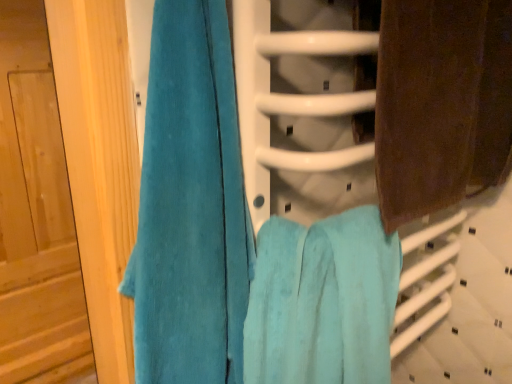
Question: Is teal plush towel at left, which is the third towel in right-to-left order, at the back of turquoise soft towel at center, the 2th towel when ordered from left to right?

Choices:
 (A) yes
 (B) no

Answer: (B)

Question: Is turquoise soft towel at center, the 2th towel when ordered from left to right, at the right side of teal plush towel at left, which is the third towel in right-to-left order?

Choices:
 (A) yes
 (B) no

Answer: (A)

Question: Is turquoise soft towel at center, positioned as the second towel in right-to-left order, shorter than teal plush towel at left, which is the third towel in right-to-left order?

Choices:
 (A) no
 (B) yes

Answer: (B)

Question: Is turquoise soft towel at center, positioned as the second towel in right-to-left order, bigger than teal plush towel at left, which is the third towel in right-to-left order?

Choices:
 (A) yes
 (B) no

Answer: (A)

Question: Is turquoise soft towel at center, the 2th towel when ordered from left to right, aimed at teal plush towel at left, which is the third towel in right-to-left order?

Choices:
 (A) no
 (B) yes

Answer: (A)

Question: From a real-world perspective, is turquoise soft towel at center, positioned as the second towel in right-to-left order, positioned above or below teal plush towel at left, the first towel positioned from the left?

Choices:
 (A) below
 (B) above

Answer: (A)

Question: Considering the positions of point (352, 304) and point (225, 107), is point (352, 304) closer or farther from the camera than point (225, 107)?

Choices:
 (A) closer
 (B) farther

Answer: (B)

Question: From the image's perspective, is turquoise soft towel at center, positioned as the second towel in right-to-left order, above or below teal plush towel at left, which is the third towel in right-to-left order?

Choices:
 (A) above
 (B) below

Answer: (B)

Question: Would you say turquoise soft towel at center, the 2th towel when ordered from left to right, is inside or outside teal plush towel at left, the first towel positioned from the left?

Choices:
 (A) outside
 (B) inside

Answer: (A)

Question: Does point (312, 299) appear closer or farther from the camera than point (468, 122)?

Choices:
 (A) closer
 (B) farther

Answer: (A)

Question: Is turquoise soft towel at center, positioned as the second towel in right-to-left order, in front of or behind brown textured towel at right, the first towel when ordered from right to left, in the image?

Choices:
 (A) behind
 (B) front

Answer: (B)

Question: From the image's perspective, is turquoise soft towel at center, the 2th towel when ordered from left to right, positioned above or below brown textured towel at right, acting as the 3th towel starting from the left?

Choices:
 (A) above
 (B) below

Answer: (B)

Question: Is turquoise soft towel at center, positioned as the second towel in right-to-left order, to the left or to the right of brown textured towel at right, acting as the 3th towel starting from the left, in the image?

Choices:
 (A) left
 (B) right

Answer: (A)

Question: Relative to wooden door at left, is brown textured towel at right, acting as the 3th towel starting from the left, in front or behind?

Choices:
 (A) behind
 (B) front

Answer: (B)

Question: Choose the correct answer: Is brown textured towel at right, acting as the 3th towel starting from the left, inside wooden door at left or outside it?

Choices:
 (A) inside
 (B) outside

Answer: (B)